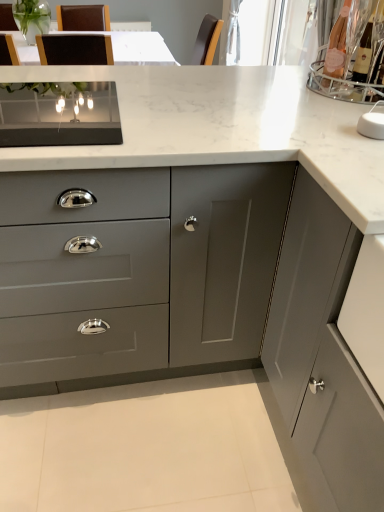
Question: Is matte gray cabinet at center, the first cabinetry positioned from the back, wider or thinner than matte gray cabinet at right, placed as the 2th cabinetry when sorted from left to right?

Choices:
 (A) thin
 (B) wide

Answer: (B)

Question: Is matte gray cabinet at center, arranged as the second cabinetry when viewed from the right, situated inside matte gray cabinet at right, the first cabinetry from the front, or outside?

Choices:
 (A) inside
 (B) outside

Answer: (B)

Question: Considering the positions of matte gray cabinet at center, the first cabinetry positioned from the back, and matte gray cabinet at right, placed as the 2th cabinetry when sorted from left to right, in the image, is matte gray cabinet at center, the first cabinetry positioned from the back, taller or shorter than matte gray cabinet at right, placed as the 2th cabinetry when sorted from left to right,?

Choices:
 (A) tall
 (B) short

Answer: (B)

Question: From the image's perspective, is matte gray cabinet at right, which is counted as the 2th cabinetry, starting from the back, above or below matte gray cabinet at center, the first cabinetry positioned from the back?

Choices:
 (A) above
 (B) below

Answer: (B)

Question: Considering the positions of matte gray cabinet at right, placed as the 2th cabinetry when sorted from left to right, and matte gray cabinet at center, the first cabinetry positioned from the back, in the image, is matte gray cabinet at right, placed as the 2th cabinetry when sorted from left to right, taller or shorter than matte gray cabinet at center, the first cabinetry positioned from the back,?

Choices:
 (A) short
 (B) tall

Answer: (B)

Question: Does point (339, 455) appear closer or farther from the camera than point (231, 334)?

Choices:
 (A) closer
 (B) farther

Answer: (A)

Question: In the image, is matte gray cabinet at right, the first cabinetry from the front, on the left side or the right side of matte gray cabinet at center, which ranks as the first cabinetry in left-to-right order?

Choices:
 (A) right
 (B) left

Answer: (A)